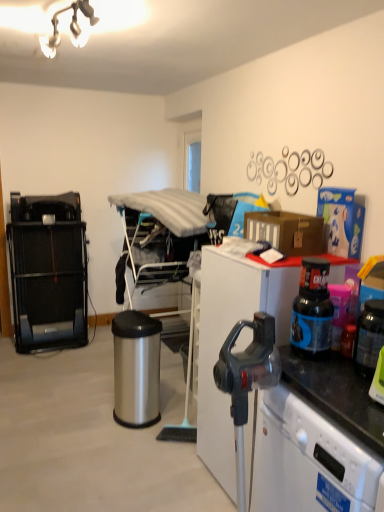
Question: From a real-world perspective, is black metal treadmill at left positioned over black plastic bottle at right based on gravity?

Choices:
 (A) yes
 (B) no

Answer: (B)

Question: From the image's perspective, is black metal treadmill at left on top of black plastic bottle at right?

Choices:
 (A) yes
 (B) no

Answer: (A)

Question: Is black metal treadmill at left directly adjacent to black plastic bottle at right?

Choices:
 (A) yes
 (B) no

Answer: (B)

Question: Is black plastic bottle at right inside black metal treadmill at left?

Choices:
 (A) no
 (B) yes

Answer: (A)

Question: Is black metal treadmill at left closer to camera compared to black plastic bottle at right?

Choices:
 (A) no
 (B) yes

Answer: (A)

Question: In terms of width, does black plastic bottle at right look wider or thinner when compared to white matte desk at right?

Choices:
 (A) wide
 (B) thin

Answer: (B)

Question: Does point (301, 314) appear closer or farther from the camera than point (281, 270)?

Choices:
 (A) farther
 (B) closer

Answer: (B)

Question: From the image's perspective, is black plastic bottle at right located above or below white matte desk at right?

Choices:
 (A) above
 (B) below

Answer: (A)

Question: Is black plastic bottle at right bigger or smaller than white matte desk at right?

Choices:
 (A) small
 (B) big

Answer: (A)

Question: Considering their positions, is polished stainless steel trash can at center located in front of or behind black plastic bottle at right?

Choices:
 (A) behind
 (B) front

Answer: (A)

Question: Considering the positions of polished stainless steel trash can at center and black plastic bottle at right in the image, is polished stainless steel trash can at center bigger or smaller than black plastic bottle at right?

Choices:
 (A) big
 (B) small

Answer: (A)

Question: From the image's perspective, is polished stainless steel trash can at center above or below black plastic bottle at right?

Choices:
 (A) above
 (B) below

Answer: (B)

Question: From their relative heights in the image, would you say polished stainless steel trash can at center is taller or shorter than black plastic bottle at right?

Choices:
 (A) tall
 (B) short

Answer: (A)

Question: Would you say translucent plastic bottle at right is to the left or to the right of metal/textured drying rack at center in the picture?

Choices:
 (A) left
 (B) right

Answer: (B)

Question: Is point (370, 343) closer or farther from the camera than point (175, 243)?

Choices:
 (A) farther
 (B) closer

Answer: (B)